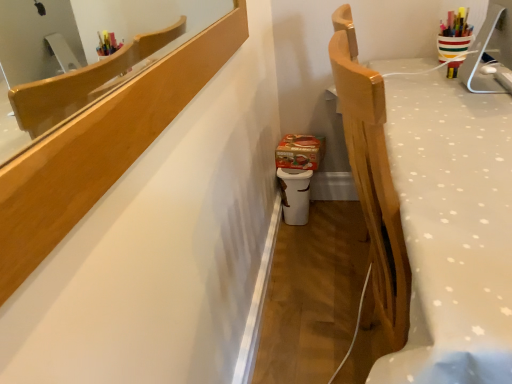
The height and width of the screenshot is (384, 512). I want to click on white dotted fabric bed at lower right, so click(x=431, y=218).

The width and height of the screenshot is (512, 384). What do you see at coordinates (431, 218) in the screenshot? I see `white dotted fabric bed at lower right` at bounding box center [431, 218].

Find the location of `white dotted fabric bed at lower right`. white dotted fabric bed at lower right is located at coordinates (431, 218).